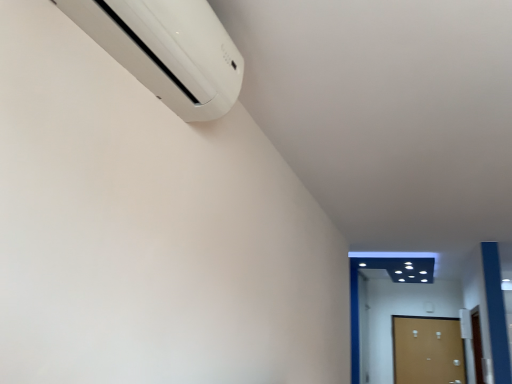
Measure the distance between wooden door at lower right, which ranks as the first door in left-to-right order, and camera.

A distance of 21.13 feet exists between wooden door at lower right, which ranks as the first door in left-to-right order, and camera.

Identify the location of brown matte door at lower right, marked as the 2th door in a left-to-right arrangement. The image size is (512, 384). (426, 350).

Locate an element on the screen. white plastic air conditioner at upper left is located at coordinates (168, 50).

Between brown matte door at lower right, marked as the 2th door in a left-to-right arrangement, and wooden door at lower right, which ranks as the first door in left-to-right order, which one has smaller width?

brown matte door at lower right, marked as the 2th door in a left-to-right arrangement.

Consider the image. From the image's perspective, which is below, brown matte door at lower right, which appears as the 1th door when viewed from the right, or wooden door at lower right, the second door positioned from the right?

brown matte door at lower right, which appears as the 1th door when viewed from the right.

Who is more distant, brown matte door at lower right, marked as the 2th door in a left-to-right arrangement, or wooden door at lower right, the second door positioned from the right?

brown matte door at lower right, marked as the 2th door in a left-to-right arrangement.

Does brown matte door at lower right, which appears as the 1th door when viewed from the right, appear on the left side of wooden door at lower right, the second door positioned from the right?

No.

From the image's perspective, is wooden door at lower right, the second door positioned from the right, above or below white plastic air conditioner at upper left?

wooden door at lower right, the second door positioned from the right, is below white plastic air conditioner at upper left.

In the image, is wooden door at lower right, the second door positioned from the right, on the left side or the right side of white plastic air conditioner at upper left?

wooden door at lower right, the second door positioned from the right, is positioned on white plastic air conditioner at upper left's right side.

Can you confirm if wooden door at lower right, the second door positioned from the right, is wider than white plastic air conditioner at upper left?

No.

Can you confirm if wooden door at lower right, the second door positioned from the right, is shorter than white plastic air conditioner at upper left?

Incorrect, the height of wooden door at lower right, the second door positioned from the right, does not fall short of that of white plastic air conditioner at upper left.

Is wooden door at lower right, the second door positioned from the right, surrounding brown matte door at lower right, marked as the 2th door in a left-to-right arrangement?

No, brown matte door at lower right, marked as the 2th door in a left-to-right arrangement, is not a part of wooden door at lower right, the second door positioned from the right.

Is wooden door at lower right, the second door positioned from the right, thinner than brown matte door at lower right, which appears as the 1th door when viewed from the right?

Incorrect, the width of wooden door at lower right, the second door positioned from the right, is not less than that of brown matte door at lower right, which appears as the 1th door when viewed from the right.

Between point (360, 300) and point (457, 322), which one is positioned behind?

The point (360, 300) is more distant.

Considering the relative positions of wooden door at lower right, the second door positioned from the right, and brown matte door at lower right, which appears as the 1th door when viewed from the right, in the image provided, is wooden door at lower right, the second door positioned from the right, to the left of brown matte door at lower right, which appears as the 1th door when viewed from the right, from the viewer's perspective?

Yes.

Could you tell me if brown matte door at lower right, marked as the 2th door in a left-to-right arrangement, is turned towards white plastic air conditioner at upper left?

Yes.

Would you say brown matte door at lower right, marked as the 2th door in a left-to-right arrangement, is inside or outside white plastic air conditioner at upper left?

brown matte door at lower right, marked as the 2th door in a left-to-right arrangement, is not inside white plastic air conditioner at upper left, it's outside.

Is brown matte door at lower right, marked as the 2th door in a left-to-right arrangement, at the right side of white plastic air conditioner at upper left?

Correct, you'll find brown matte door at lower right, marked as the 2th door in a left-to-right arrangement, to the right of white plastic air conditioner at upper left.

Considering their positions, is white plastic air conditioner at upper left located in front of or behind wooden door at lower right, the second door positioned from the right?

Visually, white plastic air conditioner at upper left is located in front of wooden door at lower right, the second door positioned from the right.

Considering the positions of objects white plastic air conditioner at upper left and wooden door at lower right, which ranks as the first door in left-to-right order, in the image provided, who is more to the right, white plastic air conditioner at upper left or wooden door at lower right, which ranks as the first door in left-to-right order,?

Positioned to the right is wooden door at lower right, which ranks as the first door in left-to-right order.

Based on their sizes in the image, would you say white plastic air conditioner at upper left is bigger or smaller than wooden door at lower right, which ranks as the first door in left-to-right order?

white plastic air conditioner at upper left is smaller than wooden door at lower right, which ranks as the first door in left-to-right order.

Can wooden door at lower right, which ranks as the first door in left-to-right order, be found inside white plastic air conditioner at upper left?

No.

From the image's perspective, is white plastic air conditioner at upper left positioned above or below brown matte door at lower right, marked as the 2th door in a left-to-right arrangement?

From the image's perspective, white plastic air conditioner at upper left appears above brown matte door at lower right, marked as the 2th door in a left-to-right arrangement.

Find the location of `home appliance that appears above the brown matte door at lower right, marked as the 2th door in a left-to-right arrangement (from the image's perspective)`. home appliance that appears above the brown matte door at lower right, marked as the 2th door in a left-to-right arrangement (from the image's perspective) is located at coordinates (168, 50).

Is white plastic air conditioner at upper left shorter than brown matte door at lower right, which appears as the 1th door when viewed from the right?

Yes.

How different are the orientations of white plastic air conditioner at upper left and brown matte door at lower right, which appears as the 1th door when viewed from the right, in degrees?

The facing directions of white plastic air conditioner at upper left and brown matte door at lower right, which appears as the 1th door when viewed from the right, are 89.5 degrees apart.

At what (x,y) coordinates should I click in order to perform the action: click on door below the wooden door at lower right, the second door positioned from the right (from a real-world perspective). Please return your answer as a coordinate pair (x, y). Looking at the image, I should click on (426, 350).

Locate an element on the screen. This screenshot has width=512, height=384. home appliance on the left side of wooden door at lower right, which ranks as the first door in left-to-right order is located at coordinates click(168, 50).

Which object lies nearer to the anchor point white plastic air conditioner at upper left, wooden door at lower right, which ranks as the first door in left-to-right order, or brown matte door at lower right, which appears as the 1th door when viewed from the right?

wooden door at lower right, which ranks as the first door in left-to-right order, lies closer to white plastic air conditioner at upper left than the other object.

Estimate the real-world distances between objects in this image. Which object is further from white plastic air conditioner at upper left, brown matte door at lower right, marked as the 2th door in a left-to-right arrangement, or wooden door at lower right, which ranks as the first door in left-to-right order?

brown matte door at lower right, marked as the 2th door in a left-to-right arrangement, is positioned further to the anchor white plastic air conditioner at upper left.

Based on the photo, considering their positions, is white plastic air conditioner at upper left positioned further to brown matte door at lower right, marked as the 2th door in a left-to-right arrangement, than wooden door at lower right, the second door positioned from the right?

The object further to brown matte door at lower right, marked as the 2th door in a left-to-right arrangement, is white plastic air conditioner at upper left.

Estimate the real-world distances between objects in this image. Which object is closer to wooden door at lower right, the second door positioned from the right, white plastic air conditioner at upper left or brown matte door at lower right, which appears as the 1th door when viewed from the right?

brown matte door at lower right, which appears as the 1th door when viewed from the right, is positioned closer to the anchor wooden door at lower right, the second door positioned from the right.

Estimate the real-world distances between objects in this image. Which object is further from wooden door at lower right, the second door positioned from the right, brown matte door at lower right, which appears as the 1th door when viewed from the right, or white plastic air conditioner at upper left?

white plastic air conditioner at upper left is further to wooden door at lower right, the second door positioned from the right.

Considering their positions, is wooden door at lower right, which ranks as the first door in left-to-right order, positioned closer to brown matte door at lower right, marked as the 2th door in a left-to-right arrangement, than white plastic air conditioner at upper left?

wooden door at lower right, which ranks as the first door in left-to-right order, lies closer to brown matte door at lower right, marked as the 2th door in a left-to-right arrangement, than the other object.

At what (x,y) coordinates should I click in order to perform the action: click on door between white plastic air conditioner at upper left and brown matte door at lower right, marked as the 2th door in a left-to-right arrangement, from front to back. Please return your answer as a coordinate pair (x, y). The image size is (512, 384). Looking at the image, I should click on (362, 328).